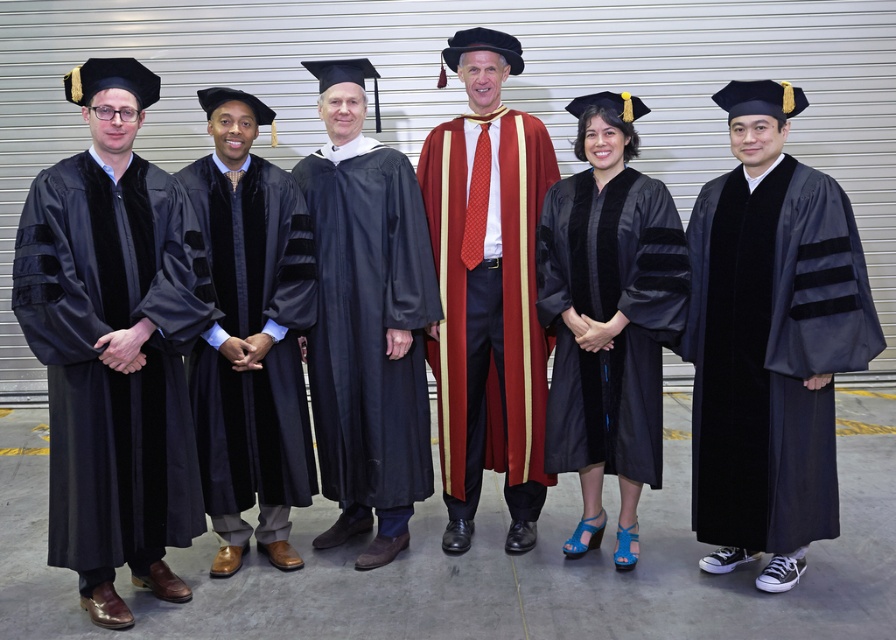
Question: Among these points, which one is nearest to the camera?

Choices:
 (A) (739, 204)
 (B) (244, 534)

Answer: (A)

Question: Can you confirm if velvet black graduation gown at right is positioned to the right of satin black gown at center?

Choices:
 (A) no
 (B) yes

Answer: (B)

Question: Which point is closer to the camera taking this photo?

Choices:
 (A) (556, 211)
 (B) (247, 380)
 (C) (339, 362)
 (D) (142, 490)

Answer: (D)

Question: Can you confirm if shiny black gown at center is wider than satin black gown at center?

Choices:
 (A) no
 (B) yes

Answer: (B)

Question: Can you confirm if matte black gown at left is smaller than shiny black gown at center?

Choices:
 (A) no
 (B) yes

Answer: (A)

Question: Which of these objects is positioned closest to the shiny black gown at center?

Choices:
 (A) velvet black graduation gown at center
 (B) maroon velvet gown at center
 (C) satin black gown at center

Answer: (A)